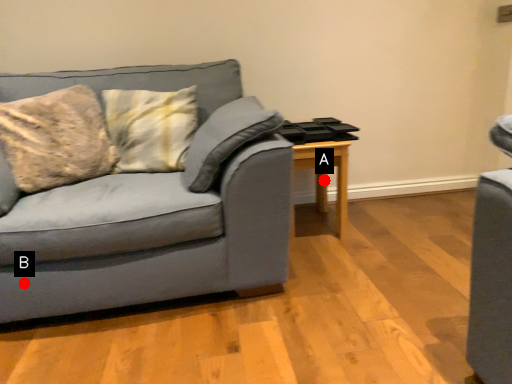
Question: Two points are circled on the image, labeled by A and B beside each circle. Which point is farther to the camera?

Choices:
 (A) A is further
 (B) B is further

Answer: (A)